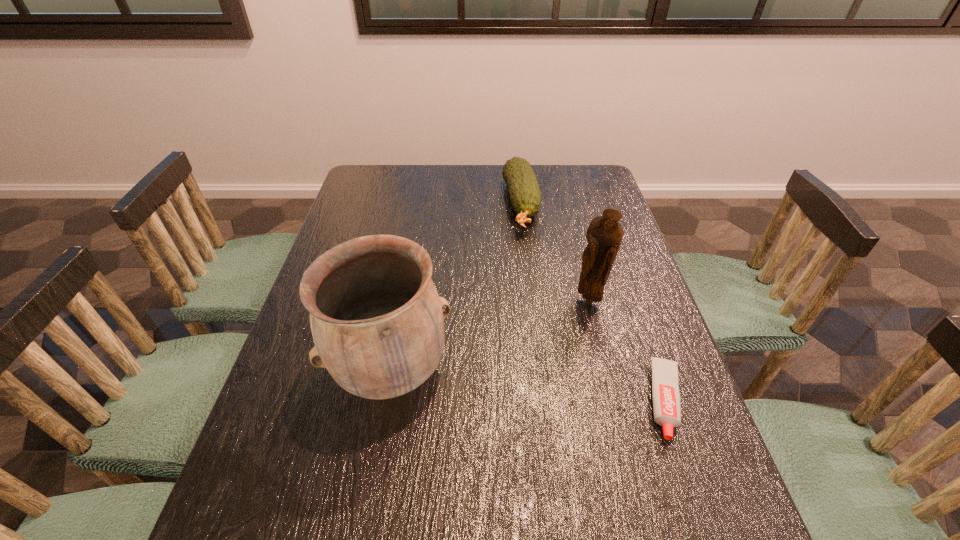
You are a GUI agent. You are given a task and a screenshot of the screen. Output one action in this format:
    pyautogui.click(x=<x>, y=<y>)
    Task: Click on the vacant space located at the blossom end of the cucumber
    Image resolution: width=960 pixels, height=540 pixels.
    Given the screenshot: What is the action you would take?
    pyautogui.click(x=533, y=268)

Find the location of a particular element. This screenshot has width=960, height=540. free point located at the blossom end of the cucumber is located at coordinates (530, 256).

The height and width of the screenshot is (540, 960). In order to click on vacant region located on the front-facing side of the second farthest object in this screenshot , I will do `click(563, 327)`.

What are the coordinates of `vacant area situated 0.260m on the front-facing side of the second farthest object` in the screenshot? It's located at (514, 370).

The image size is (960, 540). Find the location of `vacant space located on the front-facing side of the second farthest object`. vacant space located on the front-facing side of the second farthest object is located at coordinates (492, 389).

At what (x,y) coordinates should I click in order to perform the action: click on object positioned at the far edge. Please return your answer as a coordinate pair (x, y). Image resolution: width=960 pixels, height=540 pixels. Looking at the image, I should click on (525, 195).

Identify the location of object that is at the left edge. click(376, 318).

Where is `toothpaste that is at the right edge`? toothpaste that is at the right edge is located at coordinates (665, 392).

Find the location of a particular element. figurine located at the right edge is located at coordinates (604, 235).

Image resolution: width=960 pixels, height=540 pixels. In the image, there is a desktop. Find the location of `vacant space at the far edge`. vacant space at the far edge is located at coordinates (409, 165).